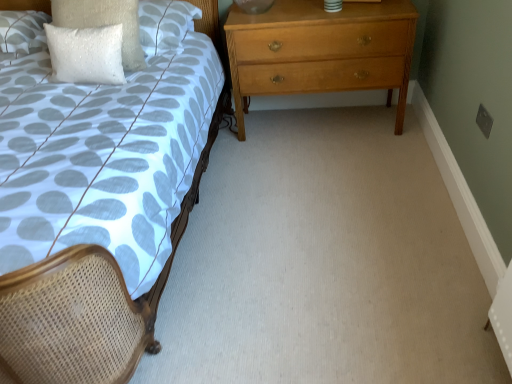
Question: Is white sequined pillow at upper left, the 2th pillow positioned from the right, completely or partially outside of white textured pillow at upper left, the third pillow viewed from the right?

Choices:
 (A) yes
 (B) no

Answer: (A)

Question: Does white sequined pillow at upper left, arranged as the 2th pillow when viewed from the left, have a greater height compared to white textured pillow at upper left, the 1th pillow viewed from the left?

Choices:
 (A) yes
 (B) no

Answer: (A)

Question: From the image's perspective, is white sequined pillow at upper left, the 2th pillow positioned from the right, on top of white textured pillow at upper left, the third pillow viewed from the right?

Choices:
 (A) no
 (B) yes

Answer: (A)

Question: Is white textured pillow at upper left, the 1th pillow viewed from the left, surrounded by white sequined pillow at upper left, arranged as the 2th pillow when viewed from the left?

Choices:
 (A) no
 (B) yes

Answer: (A)

Question: Is white sequined pillow at upper left, arranged as the 2th pillow when viewed from the left, bigger than white textured pillow at upper left, the third pillow viewed from the right?

Choices:
 (A) yes
 (B) no

Answer: (B)

Question: Considering the positions of white sequined pillow at upper left, the 2th pillow positioned from the right, and light brown wooden chest of drawers at right in the image, is white sequined pillow at upper left, the 2th pillow positioned from the right, wider or thinner than light brown wooden chest of drawers at right?

Choices:
 (A) thin
 (B) wide

Answer: (A)

Question: Do you think white sequined pillow at upper left, arranged as the 2th pillow when viewed from the left, is within light brown wooden chest of drawers at right, or outside of it?

Choices:
 (A) inside
 (B) outside

Answer: (B)

Question: Based on their sizes in the image, would you say white sequined pillow at upper left, arranged as the 2th pillow when viewed from the left, is bigger or smaller than light brown wooden chest of drawers at right?

Choices:
 (A) small
 (B) big

Answer: (A)

Question: Considering the relative positions of white sequined pillow at upper left, the 2th pillow positioned from the right, and light brown wooden chest of drawers at right in the image provided, is white sequined pillow at upper left, the 2th pillow positioned from the right, to the left or to the right of light brown wooden chest of drawers at right?

Choices:
 (A) right
 (B) left

Answer: (B)

Question: In terms of width, does matte woven bed at left look wider or thinner when compared to white sequined pillow at upper left, arranged as the 2th pillow when viewed from the left?

Choices:
 (A) wide
 (B) thin

Answer: (A)

Question: Considering their positions, is matte woven bed at left located in front of or behind white sequined pillow at upper left, arranged as the 2th pillow when viewed from the left?

Choices:
 (A) behind
 (B) front

Answer: (B)

Question: From a real-world perspective, is matte woven bed at left above or below white sequined pillow at upper left, arranged as the 2th pillow when viewed from the left?

Choices:
 (A) above
 (B) below

Answer: (B)

Question: From the image's perspective, is matte woven bed at left positioned above or below white sequined pillow at upper left, the 2th pillow positioned from the right?

Choices:
 (A) below
 (B) above

Answer: (A)

Question: In the image, is matte woven bed at left on the left side or the right side of white sequined pillow at upper left, the 1th pillow when ordered from right to left?

Choices:
 (A) right
 (B) left

Answer: (B)

Question: Considering the positions of point (132, 304) and point (89, 18), is point (132, 304) closer or farther from the camera than point (89, 18)?

Choices:
 (A) farther
 (B) closer

Answer: (B)